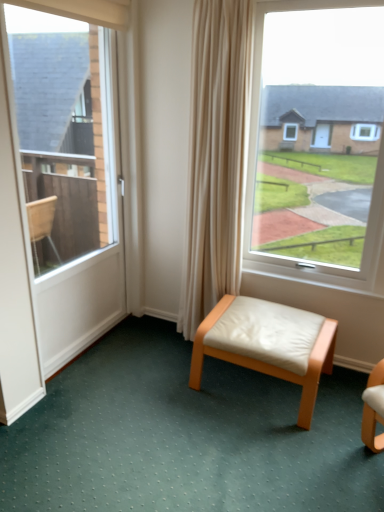
At what (x,y) coordinates should I click in order to perform the action: click on free location in front of white glossy door at left. Please return your answer as a coordinate pair (x, y). Looking at the image, I should click on (101, 399).